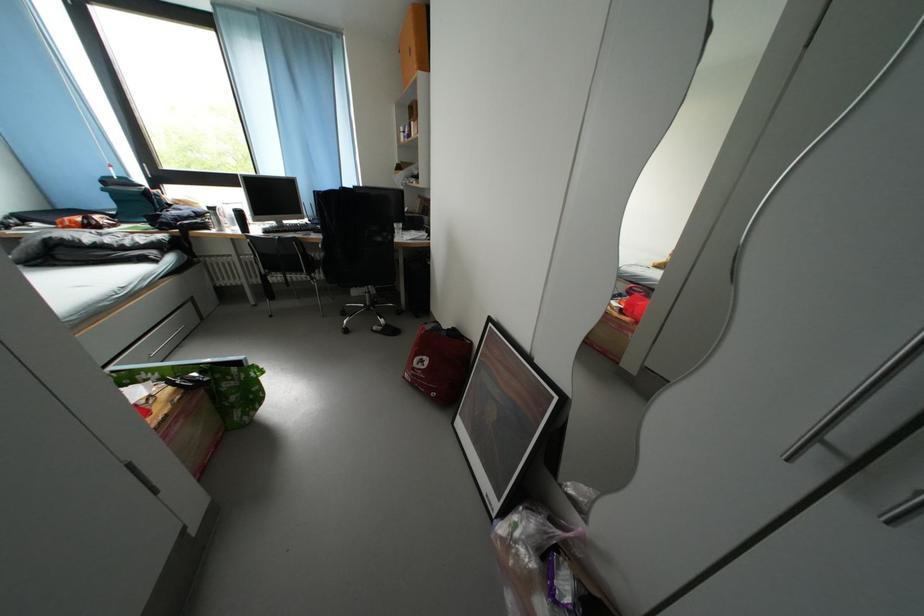
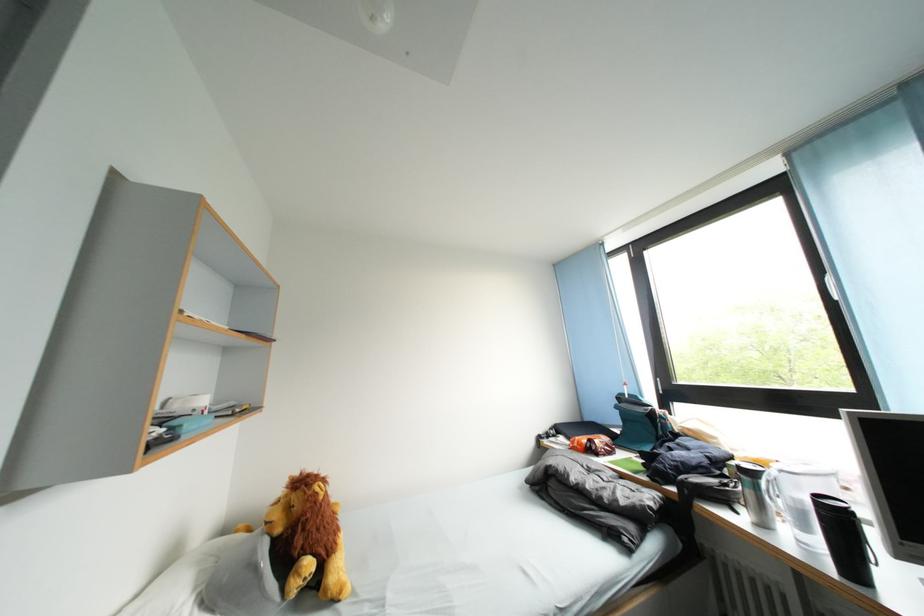
The point at (240,235) is marked in the first image. Where is the corresponding point in the second image?

(808, 546)